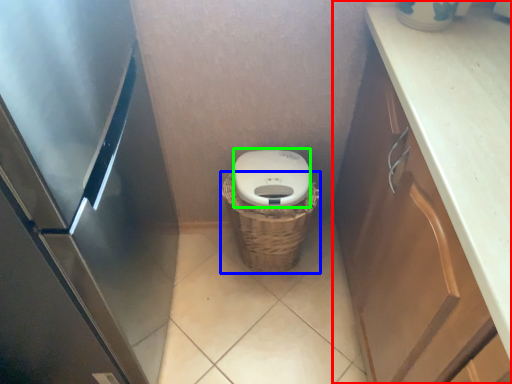
Question: Which object is the farthest from cabinetry (highlighted by a red box)? Choose among these: basket (highlighted by a blue box) or lid (highlighted by a green box).

Choices:
 (A) basket
 (B) lid

Answer: (A)